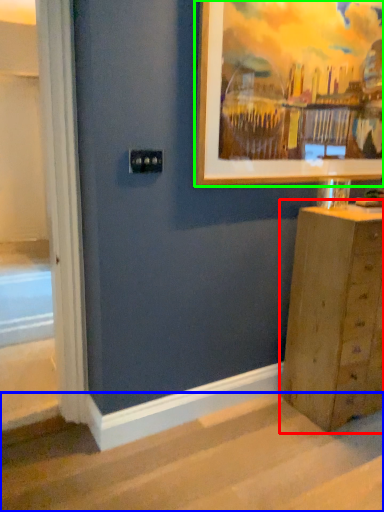
Question: Based on their relative distances, which object is nearer to chest of drawers (highlighted by a red box)? Choose from stairwell (highlighted by a blue box) and picture frame (highlighted by a green box).

Choices:
 (A) stairwell
 (B) picture frame

Answer: (A)